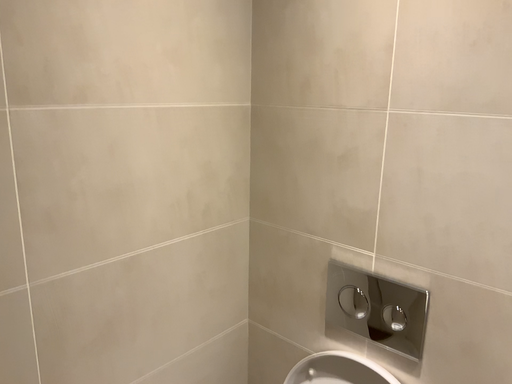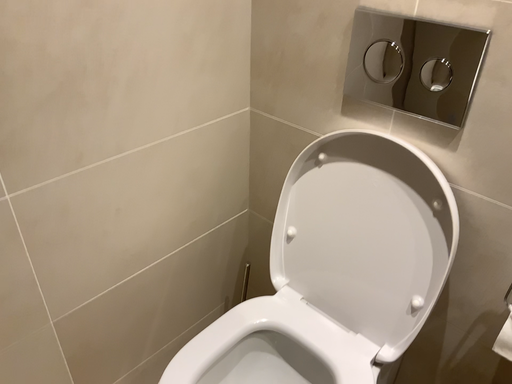
Question: Which way did the camera rotate in the video?

Choices:
 (A) rotated upward
 (B) rotated downward

Answer: (B)